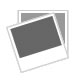
Find the location of `space to left of photos`. space to left of photos is located at coordinates (11, 55).